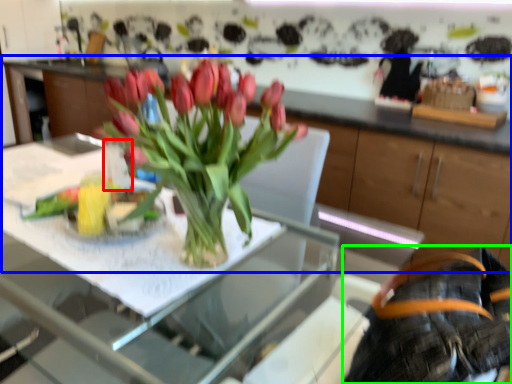
Question: Considering the real-world distances, which object is closest to vase (highlighted by a red box)? cabinetry (highlighted by a blue box) or back (highlighted by a green box).

Choices:
 (A) cabinetry
 (B) back

Answer: (B)